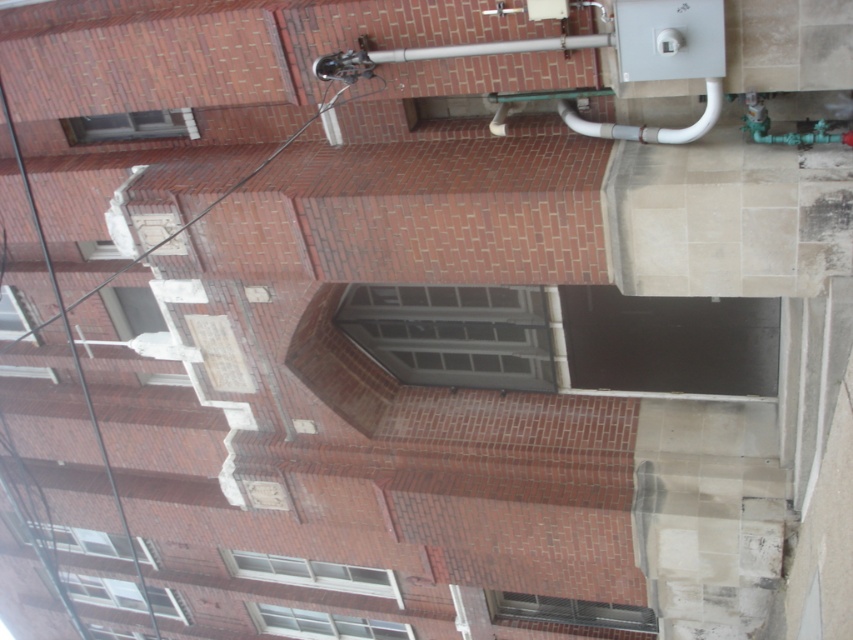
You are a maintenance worker needing to inspect two pipes located on the brick building. The silver metallic pipe at upper center and the white glossy pipe at upper right are both in need of inspection. Given that your ladder can extend up to 4 feet, can you safely reach both pipes with the same ladder placement?

The silver metallic pipe at upper center and white glossy pipe at upper right are 3.79 feet apart from each other. Since the ladder can extend up to 4 feet, you can safely reach both pipes with the same ladder placement as the distance between them is within the ladder extension limit.

You are standing in front of the brick building and see two points marked on the wall. The first point is at coordinates point (334,70) and the second is at point (579,122). Which point is closer to you?

Point (334,70) is closer to you because it is in front of point (579,122).

You are an inspector checking the pipes on a building. You see the silver metallic pipe at upper center and the white glossy pipe at upper right. Which pipe is shorter in height?

The silver metallic pipe at upper center has a lesser height compared to the white glossy pipe at upper right, so the silver metallic pipe at upper center is shorter in height.